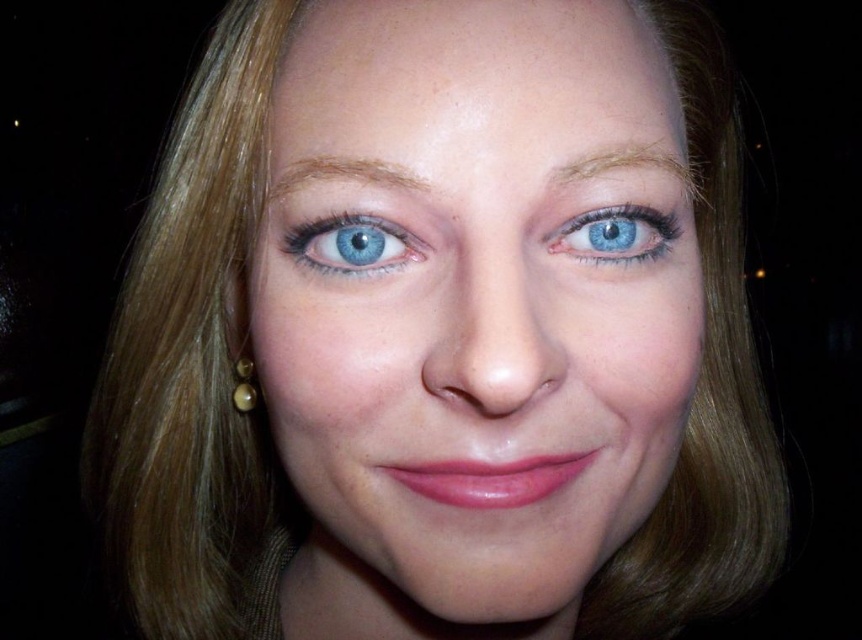
Question: From the image, what is the correct spatial relationship of blue glossy eye at center in relation to brown smooth eyebrow at upper center?

Choices:
 (A) below
 (B) above

Answer: (A)

Question: Among these points, which one is nearest to the camera?

Choices:
 (A) (386, 96)
 (B) (313, 161)
 (C) (667, 246)
 (D) (322, 264)

Answer: (A)

Question: Can you confirm if blue glossy eye at center is bigger than blue matte eye at upper center?

Choices:
 (A) no
 (B) yes

Answer: (A)

Question: Is blue matte eye at upper center bigger than gold pearl earring at lower left?

Choices:
 (A) no
 (B) yes

Answer: (A)

Question: Based on their relative distances, which object is nearer to the blue matte eye at upper center?

Choices:
 (A) brown smooth eyebrow at upper center
 (B) light brown hair at upper center
 (C) gold pearl earring at lower left

Answer: (B)

Question: Which object is positioned farthest from the blue matte eye at upper center?

Choices:
 (A) smooth skin face at center
 (B) brown smooth eyebrow at upper center
 (C) blue glossy eye at center
 (D) gold pearl earring at lower left

Answer: (D)